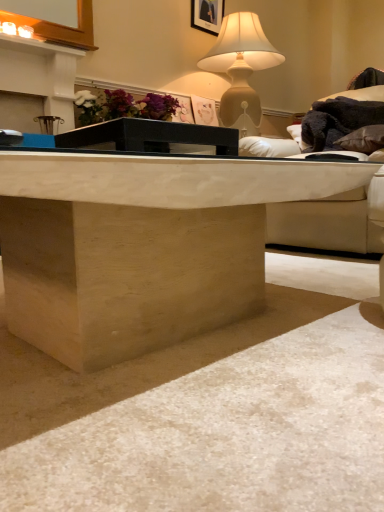
Question: Is matte black picture frame at upper center wider or thinner than white leather couch at upper right?

Choices:
 (A) wide
 (B) thin

Answer: (B)

Question: In the image, is matte black picture frame at upper center positioned in front of or behind white leather couch at upper right?

Choices:
 (A) behind
 (B) front

Answer: (A)

Question: Considering the real-world distances, which object is closest to the brown leather pillow at upper right?

Choices:
 (A) matte black flowers at upper center
 (B) black glass table at center
 (C) matte beige lamp at upper center
 (D) white leather couch at upper right
 (E) natural wood desk at center

Answer: (D)

Question: Considering the real-world distances, which object is closest to the matte black picture frame at upper center?

Choices:
 (A) black glass table at center
 (B) matte beige lamp at upper center
 (C) brown leather pillow at upper right
 (D) natural wood desk at center
 (E) white leather couch at upper right

Answer: (B)